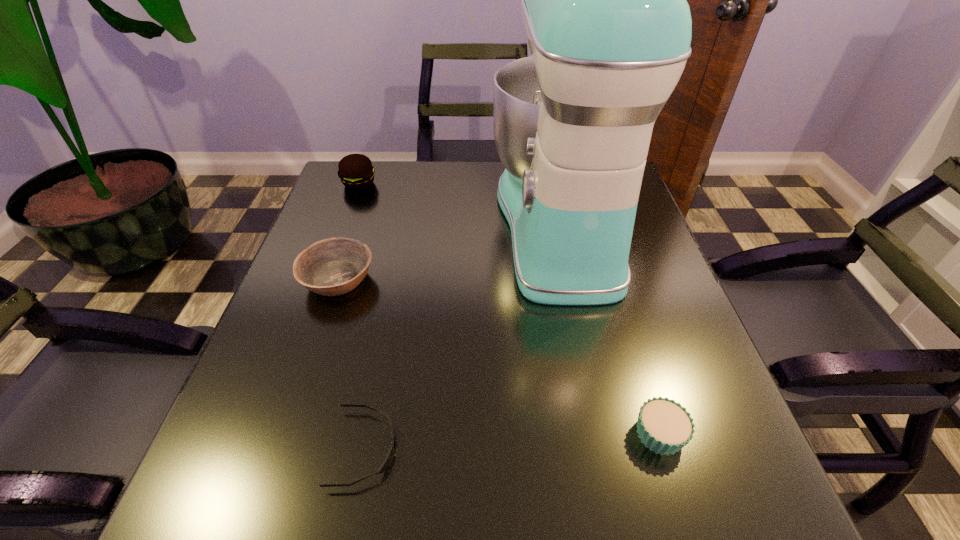
At what (x,y) coordinates should I click in order to perform the action: click on vacant area situated 0.070m on the left of the second shortest object. Please return your answer as a coordinate pair (x, y). Looking at the image, I should click on (590, 434).

This screenshot has height=540, width=960. I want to click on free space located 0.340m on the front-facing side of the shortest object, so click(610, 448).

The height and width of the screenshot is (540, 960). Identify the location of mixer positioned at the far edge. (604, 4).

Where is `patty present at the far edge`? patty present at the far edge is located at coordinates (356, 172).

Find the location of a particular element. This screenshot has width=960, height=540. object at the near edge is located at coordinates pos(385,464).

The image size is (960, 540). I want to click on patty situated at the left edge, so click(356, 172).

Identify the location of bowl situated at the left edge. (331, 267).

Find the location of `mixer positioned at the right edge`. mixer positioned at the right edge is located at coordinates (604, 4).

Where is `cupcake located in the right edge section of the desktop`? The height and width of the screenshot is (540, 960). cupcake located in the right edge section of the desktop is located at coordinates (664, 426).

You are a GUI agent. You are given a task and a screenshot of the screen. Output one action in this format:
    pyautogui.click(x=<x>, y=<y>)
    Task: Click on the object located in the far left corner section of the desktop
    The height and width of the screenshot is (540, 960).
    Given the screenshot: What is the action you would take?
    pyautogui.click(x=356, y=172)